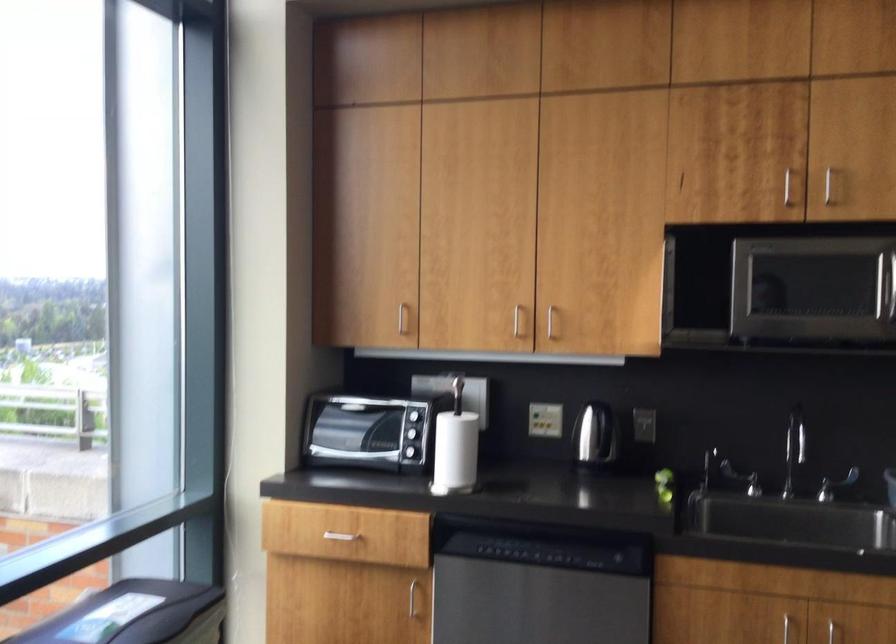
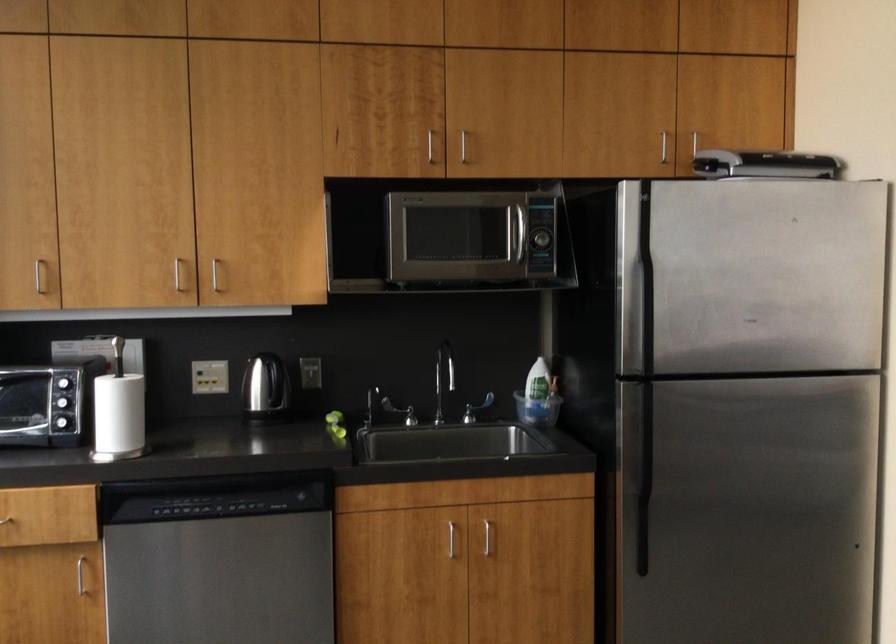
Where in the second image is the point corresponding to (x=446, y=451) from the first image?

(117, 415)